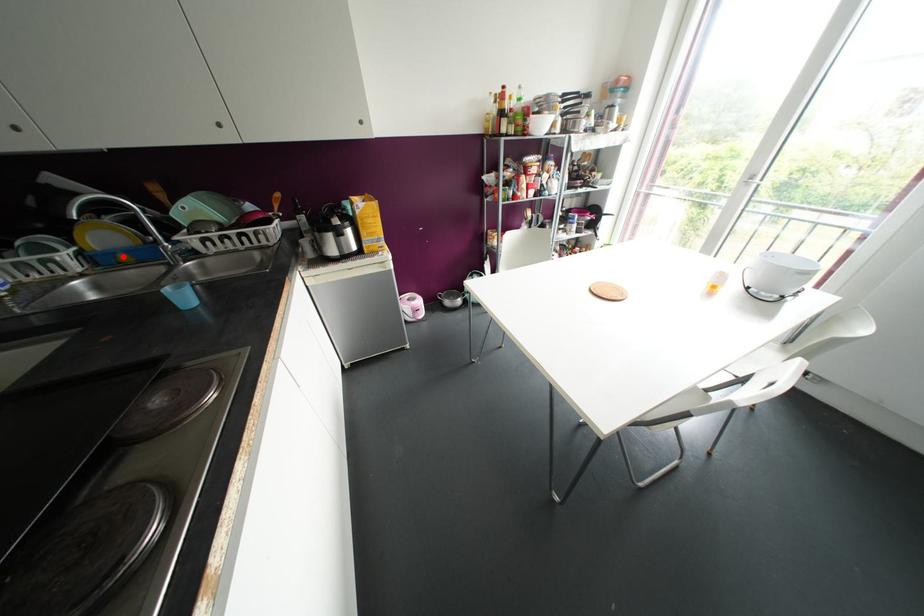
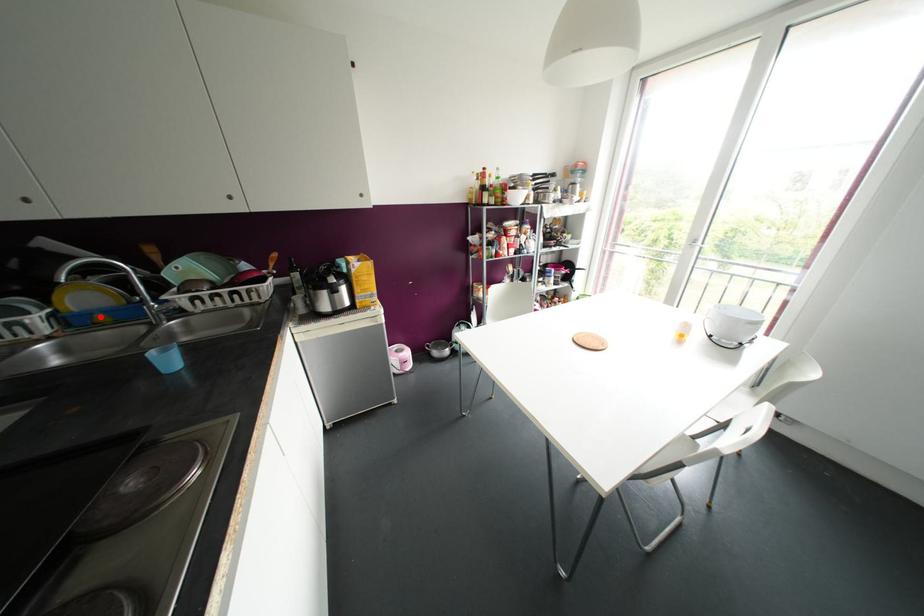
I am providing you with two images of the same scene from different viewpoints. A red point is marked on the first image and another point is marked on the second image. Does the point marked in image1 correspond to the same location as the one in image2?

Yes